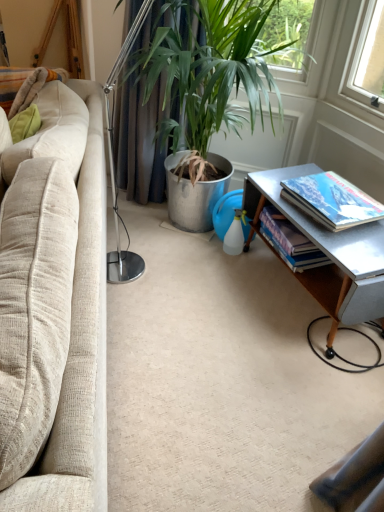
Question: From a real-world perspective, relative to green metallic plant pot at center, is beige fabric couch at left vertically above or below?

Choices:
 (A) above
 (B) below

Answer: (B)

Question: Relative to green metallic plant pot at center, is beige fabric couch at left in front or behind?

Choices:
 (A) behind
 (B) front

Answer: (B)

Question: Which object is the farthest from the green metallic plant pot at center?

Choices:
 (A) green fabric curtain at center
 (B) metallic silver table at lower right
 (C) hardcover book at right, the second book in the back-to-front sequence
 (D) beige fabric couch at left
 (E) hardcover book at lower right, placed as the second book when sorted from front to back

Answer: (E)

Question: Considering the real-world distances, which object is farthest from the metallic silver table at lower right?

Choices:
 (A) hardcover book at lower right, placed as the second book when sorted from front to back
 (B) hardcover book at right, which is counted as the 1th book, starting from the front
 (C) green fabric curtain at center
 (D) beige fabric couch at left
 (E) green metallic plant pot at center

Answer: (D)